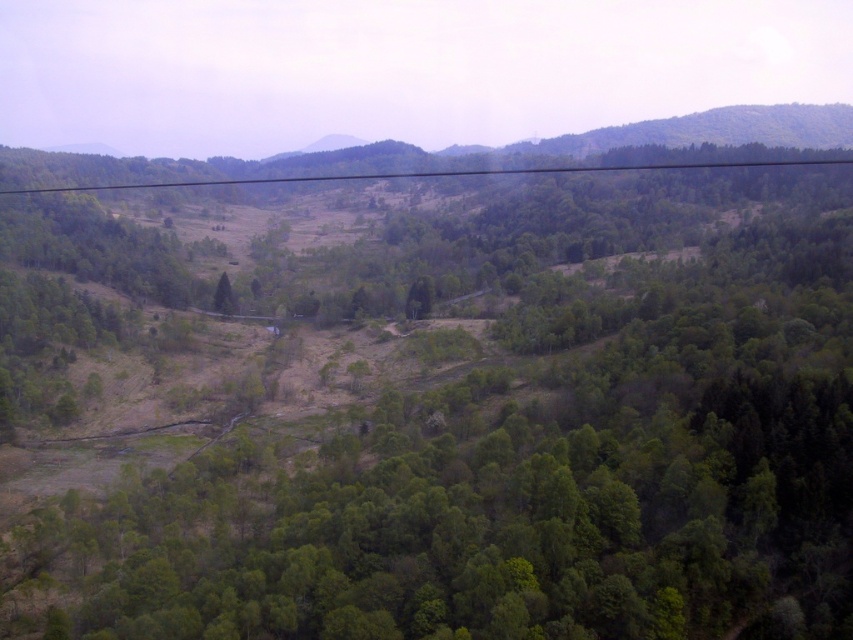
Question: Which object is closer to the camera taking this photo?

Choices:
 (A) green leafy tree at center
 (B) black wire at upper center

Answer: (A)

Question: Does black wire at upper center have a larger size compared to green leafy tree at center?

Choices:
 (A) yes
 (B) no

Answer: (A)

Question: Does black wire at upper center come behind green leafy tree at center?

Choices:
 (A) no
 (B) yes

Answer: (B)

Question: Which object is farther from the camera taking this photo?

Choices:
 (A) black wire at upper center
 (B) green leafy tree at center

Answer: (A)

Question: Considering the relative positions of black wire at upper center and green leafy tree at center in the image provided, where is black wire at upper center located with respect to green leafy tree at center?

Choices:
 (A) above
 (B) below

Answer: (A)